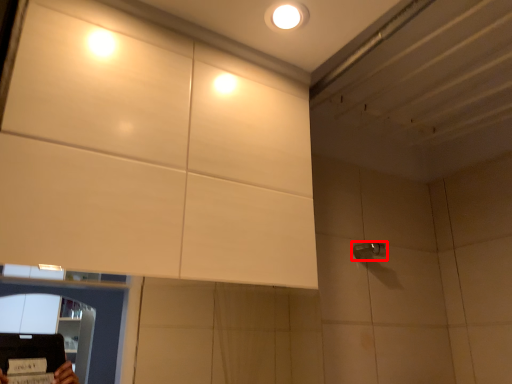
Question: From the image's perspective, where is shower (annotated by the red box) located in relation to droplight in the image?

Choices:
 (A) below
 (B) above

Answer: (A)